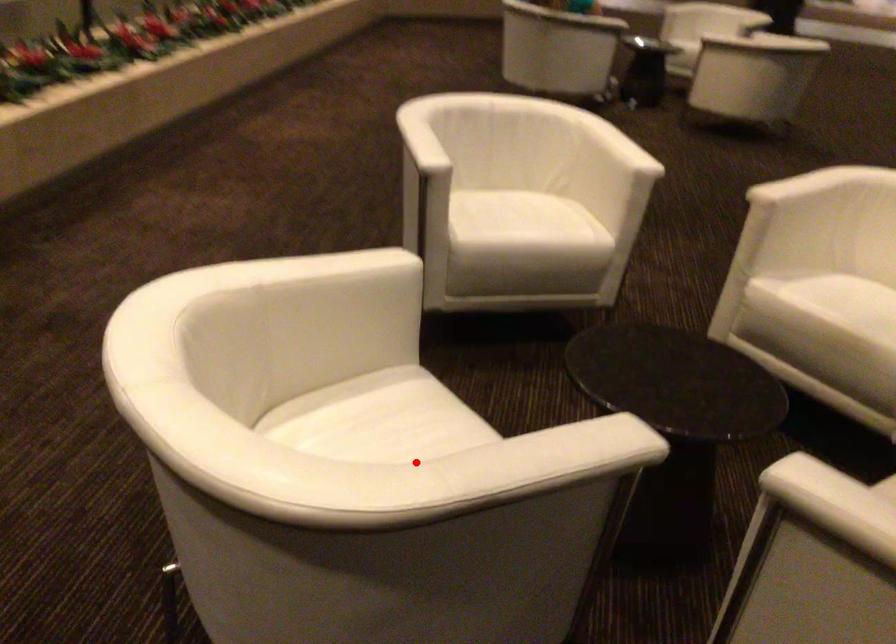
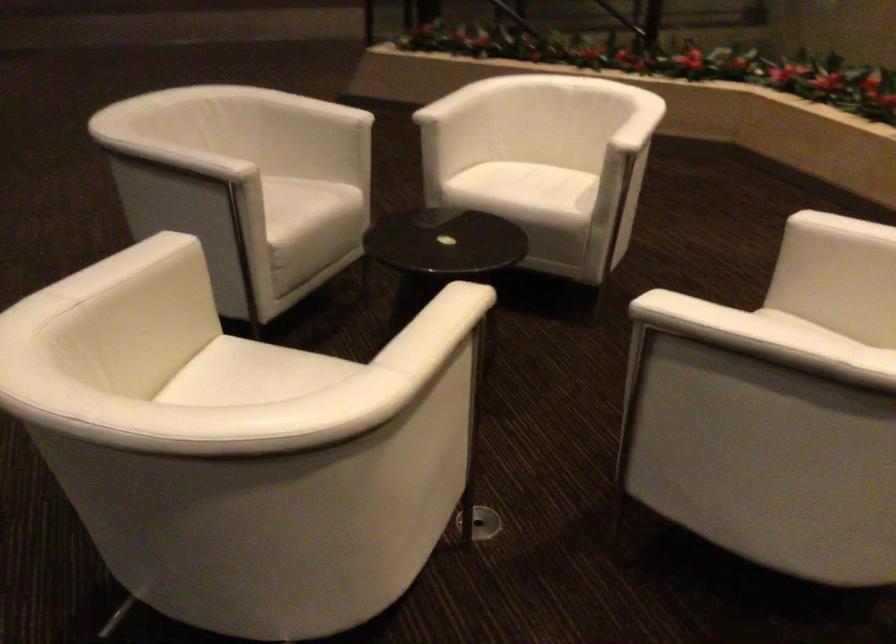
Question: A red point is marked in image1. In image2, is the corresponding 3D point closer to the camera or farther? Reply with the corresponding letter.

Choices:
 (A) The corresponding 3D point is closer.
 (B) The corresponding 3D point is farther.

Answer: (B)